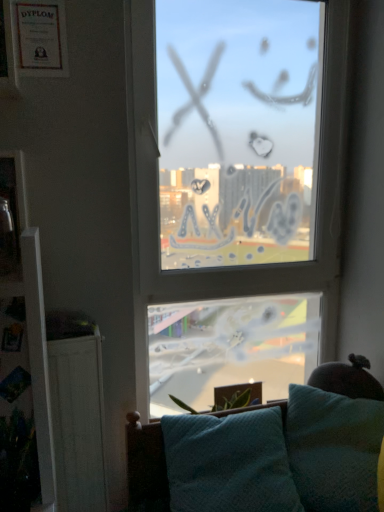
The image size is (384, 512). Describe the element at coordinates (158, 195) in the screenshot. I see `transparent glass window at center` at that location.

What is the approximate width of transparent glass window at center?

2.61 inches.

At what (x,y) coordinates should I click in order to perform the action: click on teal fabric pillow at lower right. Please return your answer as a coordinate pair (x, y). Looking at the image, I should click on (334, 449).

This screenshot has height=512, width=384. I want to click on transparent glass window at center, so click(x=158, y=195).

Which object is thinner, transparent glass window at center or matte paper frame at upper left, the 1th picture frame positioned from the back?

matte paper frame at upper left, the 1th picture frame positioned from the back, is thinner.

Based on their positions, is transparent glass window at center located to the left or right of matte paper frame at upper left, placed as the 2th picture frame when sorted from front to back?

Clearly, transparent glass window at center is on the right of matte paper frame at upper left, placed as the 2th picture frame when sorted from front to back, in the image.

Based on the photo, considering the relative sizes of transparent glass window at center and matte paper frame at upper left, the 1th picture frame positioned from the back, in the image provided, is transparent glass window at center bigger than matte paper frame at upper left, the 1th picture frame positioned from the back,?

Correct, transparent glass window at center is larger in size than matte paper frame at upper left, the 1th picture frame positioned from the back.

You are a GUI agent. You are given a task and a screenshot of the screen. Output one action in this format:
    pyautogui.click(x=<x>, y=<y>)
    Task: Click on the 1st picture frame in front of the transparent glass window at center
    This screenshot has height=512, width=384.
    Given the screenshot: What is the action you would take?
    pyautogui.click(x=40, y=37)

Based on their positions, is teal fabric pillow at lower right located to the left or right of transparent glass window at center?

teal fabric pillow at lower right is to the right of transparent glass window at center.

You are a GUI agent. You are given a task and a screenshot of the screen. Output one action in this format:
    pyautogui.click(x=<x>, y=<y>)
    Task: Click on the window behind the teal fabric pillow at lower right
    This screenshot has width=384, height=512.
    Given the screenshot: What is the action you would take?
    pyautogui.click(x=158, y=195)

Considering the relative sizes of teal fabric pillow at lower right and transparent glass window at center in the image provided, is teal fabric pillow at lower right thinner than transparent glass window at center?

In fact, teal fabric pillow at lower right might be wider than transparent glass window at center.

How many degrees apart are the facing directions of teal fabric pillow at lower right and transparent glass window at center?

40.3 degrees.

Measure the distance from metallic glass picture frame at left, the first picture frame positioned from the front, to matte paper frame at upper left, the 1th picture frame positioned from the back.

metallic glass picture frame at left, the first picture frame positioned from the front, is 14.47 inches from matte paper frame at upper left, the 1th picture frame positioned from the back.

From a real-world perspective, does metallic glass picture frame at left, which appears as the second picture frame when viewed from the top, sit lower than matte paper frame at upper left, positioned as the first picture frame in top-to-bottom order?

Yes, from a real-world perspective, metallic glass picture frame at left, which appears as the second picture frame when viewed from the top, is under matte paper frame at upper left, positioned as the first picture frame in top-to-bottom order.

What's the angular difference between metallic glass picture frame at left, acting as the 2th picture frame starting from the back, and matte paper frame at upper left, placed as the 2th picture frame when sorted from front to back,'s facing directions?

They differ by 1.27 degrees in their facing directions.

Is metallic glass picture frame at left, which appears as the second picture frame when viewed from the top, inside the boundaries of matte paper frame at upper left, positioned as the first picture frame in top-to-bottom order, or outside?

The correct answer is: outside.

Which object is wider, metallic glass picture frame at left, which is counted as the 1th picture frame, starting from the bottom, or teal fabric studio couch at lower center?

teal fabric studio couch at lower center.

How many degrees apart are the facing directions of metallic glass picture frame at left, which is counted as the 1th picture frame, starting from the bottom, and teal fabric studio couch at lower center?

They differ by 2.07 degrees in their facing directions.

Is point (16, 243) closer or farther from the camera than point (239, 412)?

Clearly, point (16, 243) is closer to the camera than point (239, 412).

Find the location of a particular element. This screenshot has width=384, height=512. picture frame in front of the teal fabric studio couch at lower center is located at coordinates (11, 213).

Is transparent glass window at center not within teal fabric pillow at lower right?

Indeed, transparent glass window at center is completely outside teal fabric pillow at lower right.

Considering the sizes of objects transparent glass window at center and teal fabric pillow at lower right in the image provided, who is wider, transparent glass window at center or teal fabric pillow at lower right?

teal fabric pillow at lower right is wider.

From a real-world perspective, is transparent glass window at center positioned under teal fabric pillow at lower right based on gravity?

Incorrect, from a real-world perspective, transparent glass window at center is higher than teal fabric pillow at lower right.

Between transparent glass window at center and teal fabric pillow at lower right, which one is positioned behind?

Positioned behind is transparent glass window at center.

Is matte paper frame at upper left, the second picture frame in the bottom-to-top sequence, situated inside transparent glass window at center or outside?

matte paper frame at upper left, the second picture frame in the bottom-to-top sequence, is not inside transparent glass window at center, it's outside.

Can you confirm if matte paper frame at upper left, positioned as the first picture frame in top-to-bottom order, is positioned to the right of transparent glass window at center?

Incorrect, matte paper frame at upper left, positioned as the first picture frame in top-to-bottom order, is not on the right side of transparent glass window at center.

Where is `the 1st picture frame counting from the left of the transparent glass window at center`? Image resolution: width=384 pixels, height=512 pixels. the 1st picture frame counting from the left of the transparent glass window at center is located at coordinates (40, 37).

Is matte paper frame at upper left, the 1th picture frame positioned from the back, positioned with its back to transparent glass window at center?

No, matte paper frame at upper left, the 1th picture frame positioned from the back, is not facing away from transparent glass window at center.

Does matte paper frame at upper left, the second picture frame in the bottom-to-top sequence, have a smaller size compared to teal fabric pillow at lower right?

Indeed, matte paper frame at upper left, the second picture frame in the bottom-to-top sequence, has a smaller size compared to teal fabric pillow at lower right.

I want to click on pillow directly beneath the matte paper frame at upper left, the 1th picture frame positioned from the back (from a real-world perspective), so click(334, 449).

Is matte paper frame at upper left, positioned as the first picture frame in top-to-bottom order, taller or shorter than teal fabric pillow at lower right?

Considering their sizes, matte paper frame at upper left, positioned as the first picture frame in top-to-bottom order, has less height than teal fabric pillow at lower right.

Starting from the transparent glass window at center, which picture frame is the 1st one in front? Please provide its 2D coordinates.

[(40, 37)]

Where is `window that appears above the teal fabric pillow at lower right (from the image's perspective)`? window that appears above the teal fabric pillow at lower right (from the image's perspective) is located at coordinates (158, 195).

Looking at the image, which one is located closer to transparent glass window at center, matte paper frame at upper left, the 1th picture frame positioned from the back, or metallic glass picture frame at left, which appears as the second picture frame when viewed from the top?

matte paper frame at upper left, the 1th picture frame positioned from the back, is closer to transparent glass window at center.

When comparing their distances from transparent glass window at center, does teal fabric pillow at lower right or teal fabric studio couch at lower center seem further?

teal fabric studio couch at lower center lies further to transparent glass window at center than the other object.

When comparing their distances from metallic glass picture frame at left, which appears as the second picture frame when viewed from the top, does teal fabric studio couch at lower center or teal fabric pillow at lower right seem closer?

Based on the image, teal fabric studio couch at lower center appears to be nearer to metallic glass picture frame at left, which appears as the second picture frame when viewed from the top.

From the image, which object appears to be farther from teal fabric studio couch at lower center, transparent glass window at center or metallic glass picture frame at left, acting as the 2th picture frame starting from the back?

metallic glass picture frame at left, acting as the 2th picture frame starting from the back, is positioned further to the anchor teal fabric studio couch at lower center.

Considering their positions, is transparent glass window at center positioned further to matte paper frame at upper left, the 1th picture frame positioned from the back, than teal fabric studio couch at lower center?

teal fabric studio couch at lower center.

From the image, which object appears to be farther from teal fabric studio couch at lower center, teal fabric pillow at lower right or matte paper frame at upper left, the 1th picture frame positioned from the back?

The object further to teal fabric studio couch at lower center is matte paper frame at upper left, the 1th picture frame positioned from the back.

Based on their spatial positions, is teal fabric studio couch at lower center or transparent glass window at center closer to matte paper frame at upper left, positioned as the first picture frame in top-to-bottom order?

transparent glass window at center is positioned closer to the anchor matte paper frame at upper left, positioned as the first picture frame in top-to-bottom order.

When comparing their distances from teal fabric studio couch at lower center, does metallic glass picture frame at left, which appears as the second picture frame when viewed from the top, or transparent glass window at center seem closer?

transparent glass window at center is closer to teal fabric studio couch at lower center.

Find the location of a particular element. picture frame that lies between matte paper frame at upper left, positioned as the first picture frame in top-to-bottom order, and teal fabric pillow at lower right from top to bottom is located at coordinates (11, 213).

Locate an element on the screen. The image size is (384, 512). pillow between transparent glass window at center and teal fabric studio couch at lower center vertically is located at coordinates (334, 449).

You are a GUI agent. You are given a task and a screenshot of the screen. Output one action in this format:
    pyautogui.click(x=<x>, y=<y>)
    Task: Click on the studio couch located between metallic glass picture frame at left, acting as the 2th picture frame starting from the back, and teal fabric pillow at lower right in the left-right direction
    This screenshot has width=384, height=512.
    Given the screenshot: What is the action you would take?
    pyautogui.click(x=146, y=466)

Where is `window between matte paper frame at upper left, the 1th picture frame positioned from the back, and teal fabric pillow at lower right vertically`? Image resolution: width=384 pixels, height=512 pixels. window between matte paper frame at upper left, the 1th picture frame positioned from the back, and teal fabric pillow at lower right vertically is located at coordinates (158, 195).